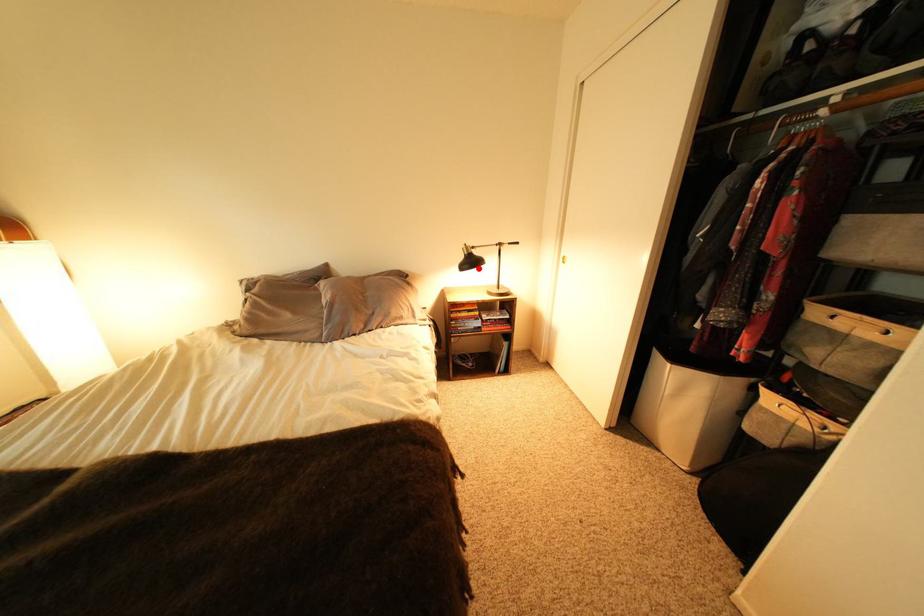
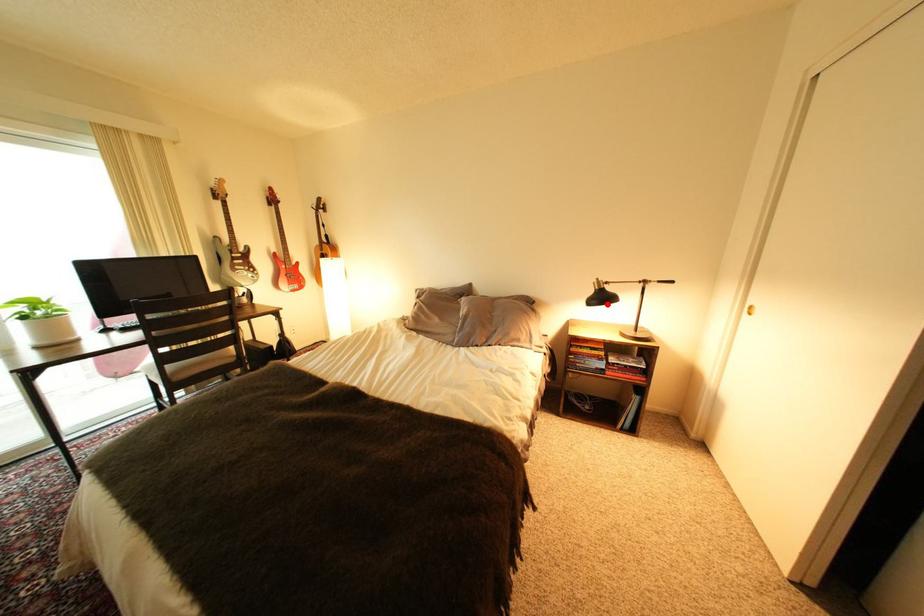
I am providing you with two images of the same scene from different viewpoints. A red point is marked on the first image and another point is marked on the second image. Is the red point in image1 aligned with the point shown in image2?

Yes